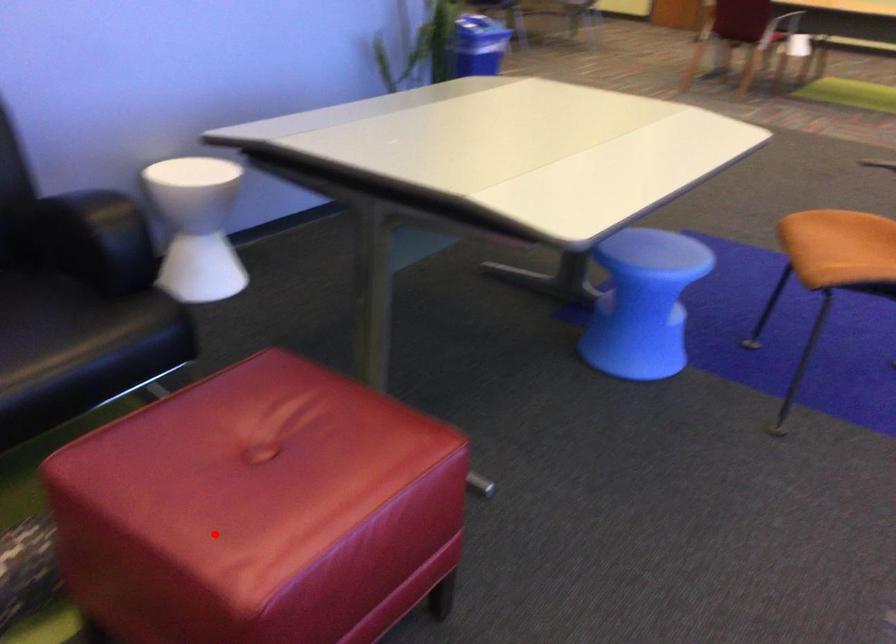
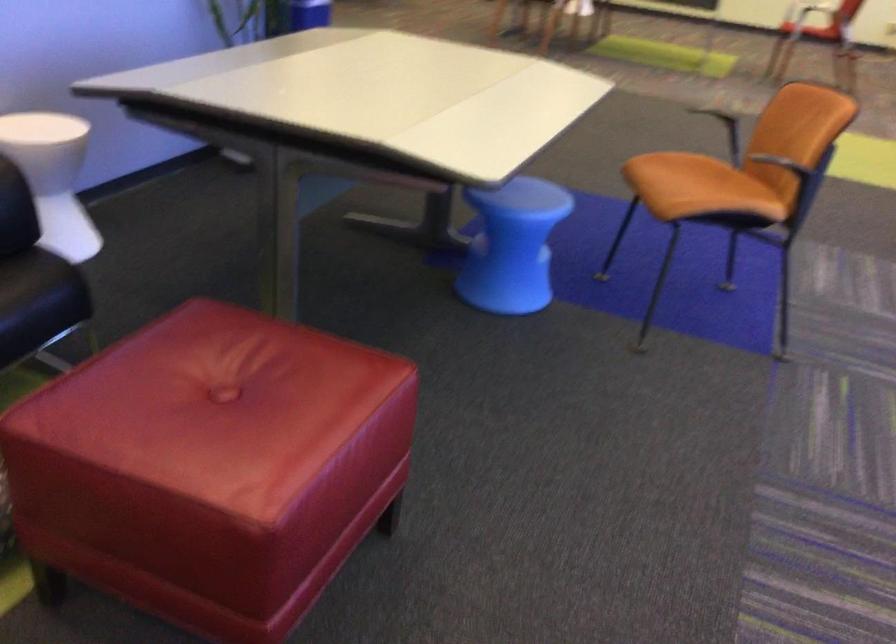
Find the pixel in the second image that matches the highlighted location in the first image.

(211, 466)